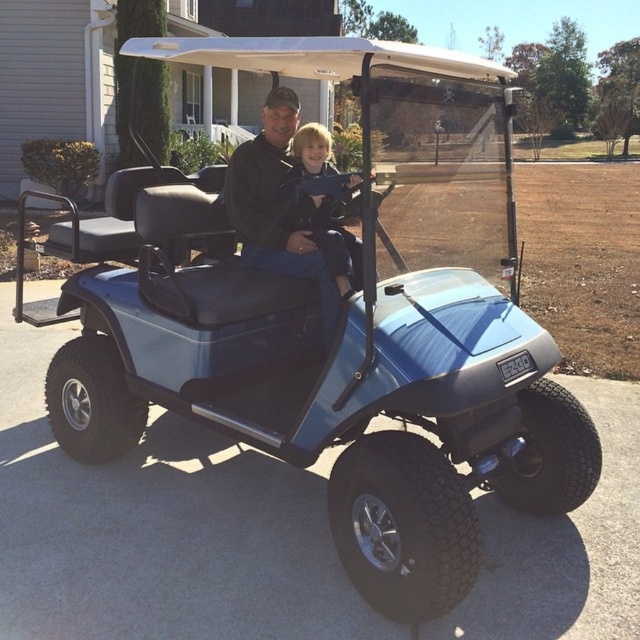
Is point (278, 192) less distant than point (333, 264)?

No, it is not.

Does black matte jacket at center appear under blonde hair boy at center?

Yes, black matte jacket at center is below blonde hair boy at center.

This screenshot has width=640, height=640. In order to click on black matte jacket at center in this screenshot , I will do `click(289, 212)`.